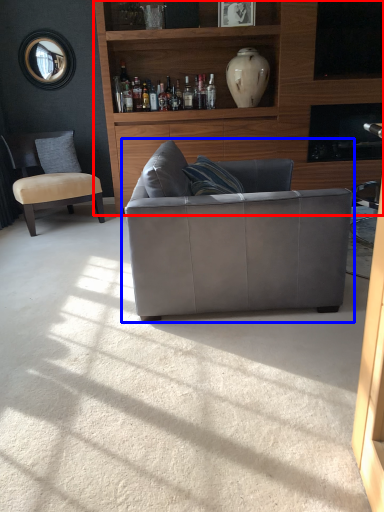
Question: Which object appears farthest to the camera in this image, entertainment center (highlighted by a red box) or studio couch (highlighted by a blue box)?

Choices:
 (A) entertainment center
 (B) studio couch

Answer: (A)